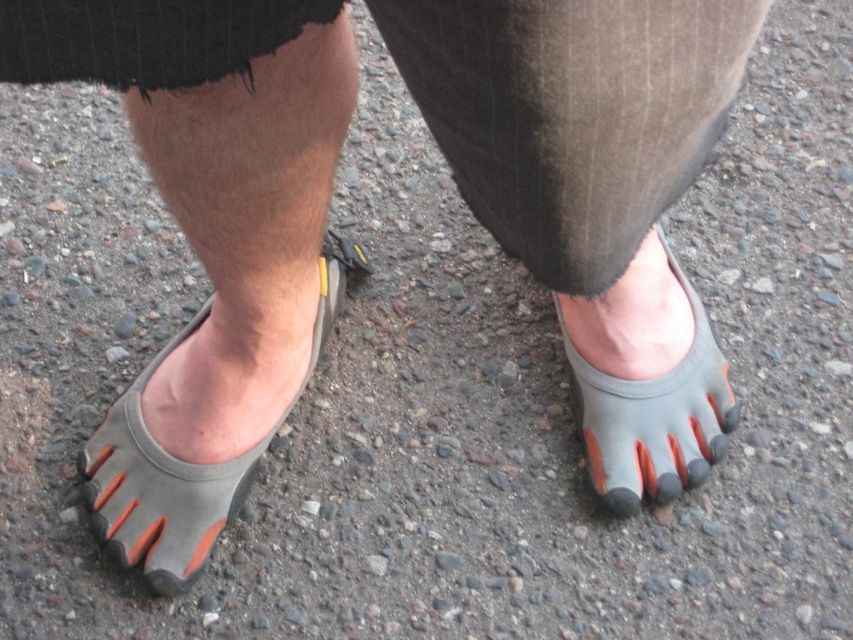
Does gray rubber toe shoe at center have a lesser height compared to orange rubber toe at center?

No, gray rubber toe shoe at center is not shorter than orange rubber toe at center.

Who is more forward, (187, 550) or (656, 481)?

Point (187, 550)

Find the location of a particular element. gray rubber toe shoe at center is located at coordinates (175, 472).

Does gray rubber toe-separated shoe at lower center appear under orange rubber toe at center?

Actually, gray rubber toe-separated shoe at lower center is above orange rubber toe at center.

Is gray rubber toe-separated shoe at lower center closer to camera compared to orange rubber toe at center?

Yes.

Between point (737, 406) and point (672, 493), which one is positioned behind?

The point (737, 406) is behind.

At what (x,y) coordinates should I click in order to perform the action: click on gray rubber toe-separated shoe at lower center. Please return your answer as a coordinate pair (x, y). The height and width of the screenshot is (640, 853). Looking at the image, I should click on (653, 413).

Is point (140, 410) behind point (701, 320)?

No, (140, 410) is closer to viewer.

The width and height of the screenshot is (853, 640). What do you see at coordinates (175, 472) in the screenshot?
I see `gray rubber toe shoe at center` at bounding box center [175, 472].

This screenshot has height=640, width=853. What do you see at coordinates (175, 472) in the screenshot? I see `gray rubber toe shoe at center` at bounding box center [175, 472].

Image resolution: width=853 pixels, height=640 pixels. I want to click on gray rubber toe shoe at center, so click(x=175, y=472).